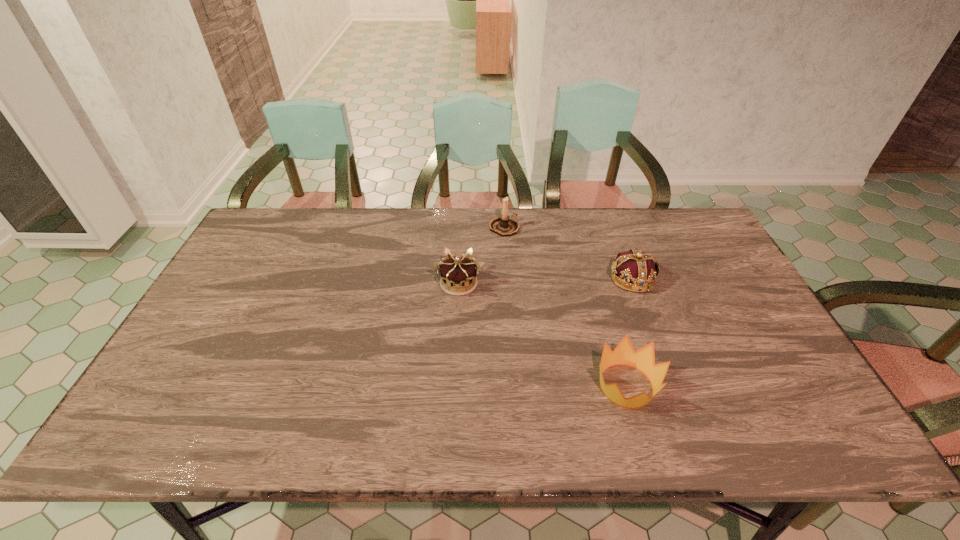
The image size is (960, 540). What are the coordinates of `the tallest object` in the screenshot? It's located at (504, 226).

Image resolution: width=960 pixels, height=540 pixels. What are the coordinates of `the farthest object` in the screenshot? It's located at (504, 226).

At what (x,y) coordinates should I click in order to perform the action: click on the leftmost object. Please return your answer as a coordinate pair (x, y). Looking at the image, I should click on (457, 275).

The width and height of the screenshot is (960, 540). Find the location of `the nearest crown`. the nearest crown is located at coordinates (643, 359).

This screenshot has width=960, height=540. Identify the location of vacant region located on the right of the farthest object. pos(609,228).

This screenshot has width=960, height=540. What are the coordinates of `free location located on the back of the leftmost object` in the screenshot? It's located at [462, 222].

At what (x,y) coordinates should I click in order to perform the action: click on vacant space located 0.080m on the back of the nearest crown. Please return your answer as a coordinate pair (x, y). This screenshot has height=540, width=960. Looking at the image, I should click on (612, 335).

At what (x,y) coordinates should I click in order to perform the action: click on object at the far edge. Please return your answer as a coordinate pair (x, y). This screenshot has height=540, width=960. Looking at the image, I should click on (504, 226).

Where is `object present at the near edge`? The image size is (960, 540). object present at the near edge is located at coordinates (643, 359).

The height and width of the screenshot is (540, 960). I want to click on free location at the far edge of the desktop, so click(x=414, y=251).